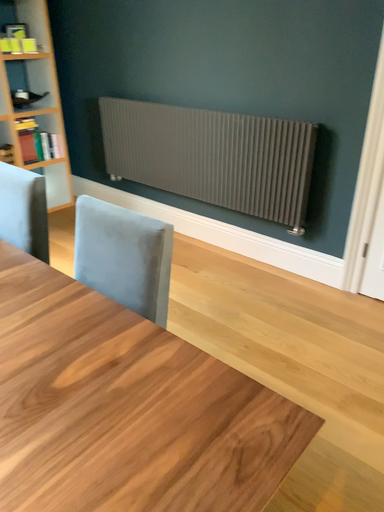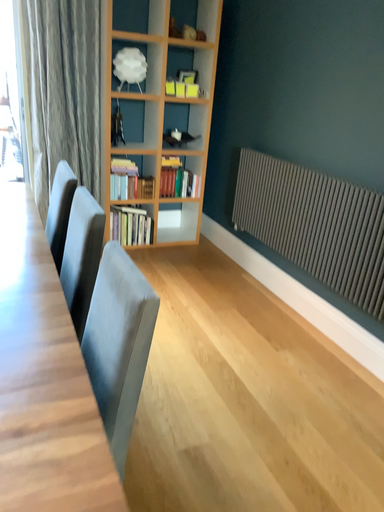
Question: How did the camera likely rotate when shooting the video?

Choices:
 (A) rotated downward
 (B) rotated upward

Answer: (B)